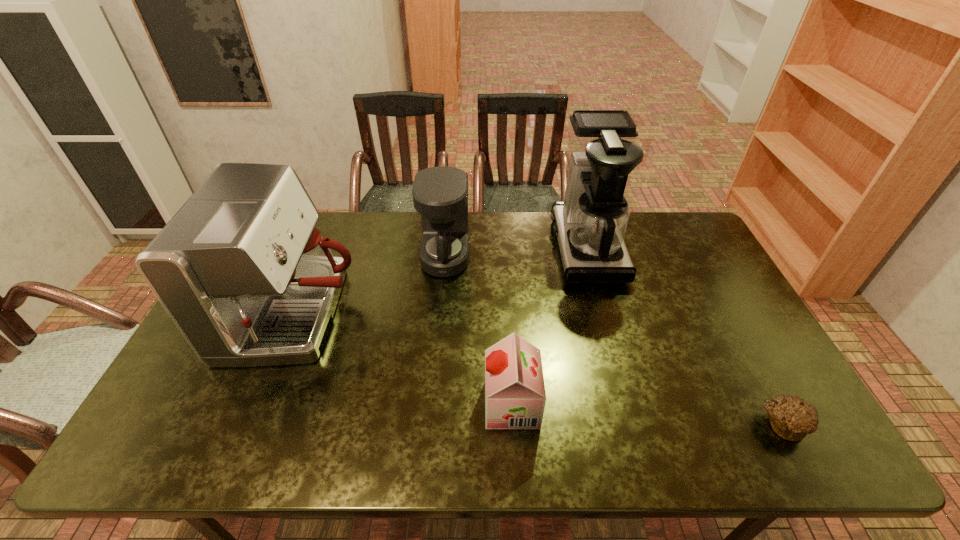
This screenshot has width=960, height=540. In order to click on vacant space that satisfies the following two spatial constraints: 1. on the back side of the muffin; 2. on the button side of the second coffee maker from left to right in this screenshot , I will do `click(692, 257)`.